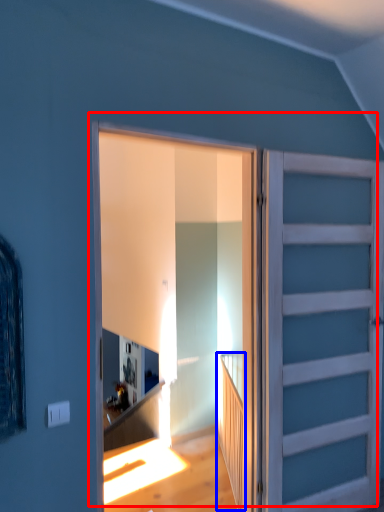
Question: Among these objects, which one is farthest to the camera, door (highlighted by a red box) or stairwell (highlighted by a blue box)?

Choices:
 (A) door
 (B) stairwell

Answer: (B)